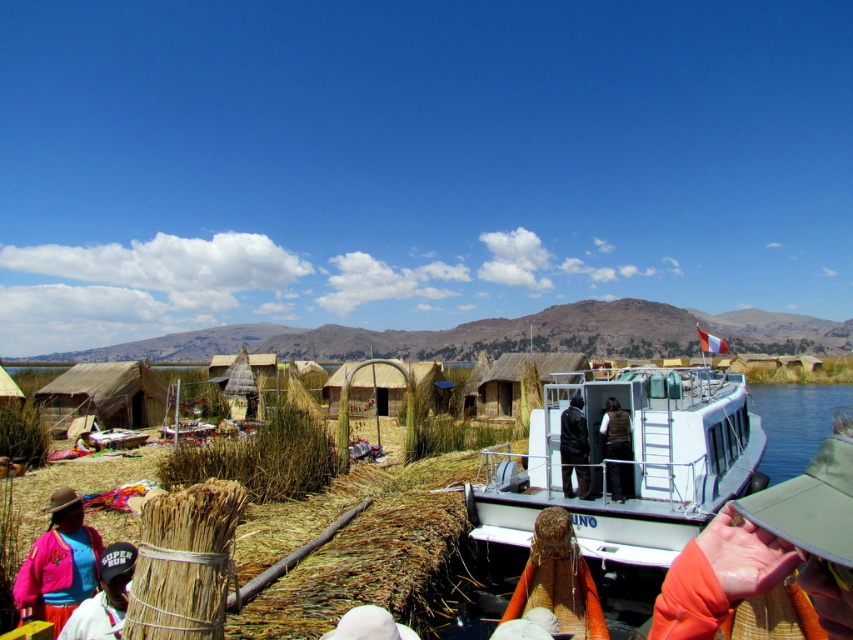
Which of these two, white matte boat at center or black leather jacket at center, stands shorter?

black leather jacket at center is shorter.

Can you confirm if white matte boat at center is positioned above black leather jacket at center?

Actually, white matte boat at center is below black leather jacket at center.

Which is behind, point (654, 484) or point (561, 456)?

Point (561, 456)

Where is `white matte boat at center`? The height and width of the screenshot is (640, 853). white matte boat at center is located at coordinates (628, 464).

Which is in front, point (534, 474) or point (608, 422)?

Point (608, 422) is in front.

Who is taller, white matte boat at center or brown leather vest at center?

white matte boat at center is taller.

Consider the image. Who is more distant from viewer, (660, 506) or (616, 451)?

The point (616, 451) is more distant.

Locate an element on the screen. This screenshot has height=640, width=853. white matte boat at center is located at coordinates (628, 464).

Does matte pink sweater at lower left have a greater height compared to multicolored woven fabric at lower left?

Indeed, matte pink sweater at lower left has a greater height compared to multicolored woven fabric at lower left.

Does matte pink sweater at lower left have a larger size compared to multicolored woven fabric at lower left?

Correct, matte pink sweater at lower left is larger in size than multicolored woven fabric at lower left.

This screenshot has height=640, width=853. Describe the element at coordinates (57, 564) in the screenshot. I see `matte pink sweater at lower left` at that location.

Image resolution: width=853 pixels, height=640 pixels. I want to click on matte pink sweater at lower left, so click(57, 564).